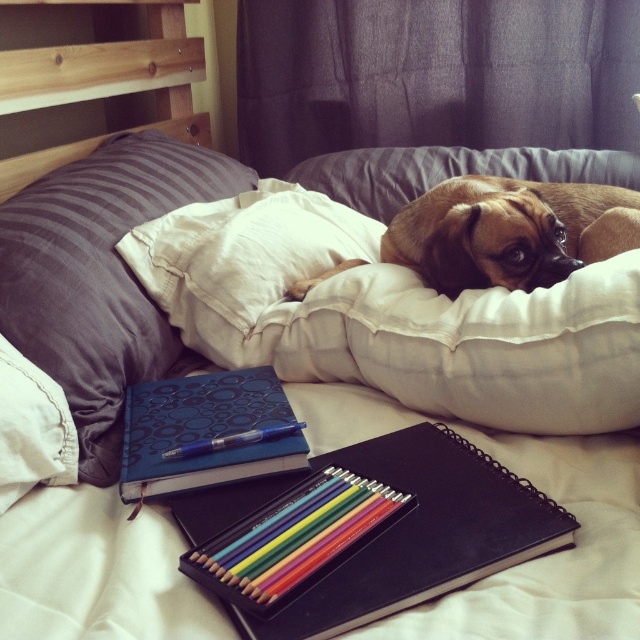
What object is located at the point with coordinates (x=204, y=432) in the image?

The point at coordinates (x=204, y=432) corresponds to the blue textured notebook at center.

You are organizing the bed and need to place a new decorative pillow. The new pillow is wider than the brown fur dog at center. Will it fit in the space currently occupied by the white soft pillow at center?

The white soft pillow at center is wider than the brown fur dog at center. Since the new pillow is wider than the brown fur dog at center, it may not fit in the space occupied by the white soft pillow at center unless the new pillow is narrower than the existing white soft pillow.

You are organizing a craft station and need to place the blue textured notebook at center and the matte wooden pencils at center closer together. Currently, how far apart are they?

The blue textured notebook at center and matte wooden pencils at center are 7.50 inches apart.